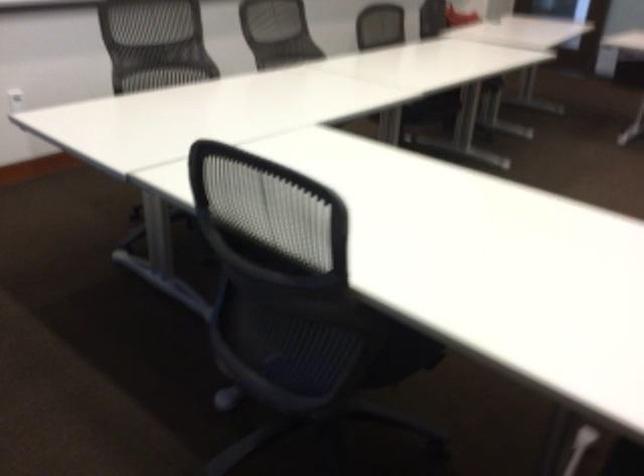
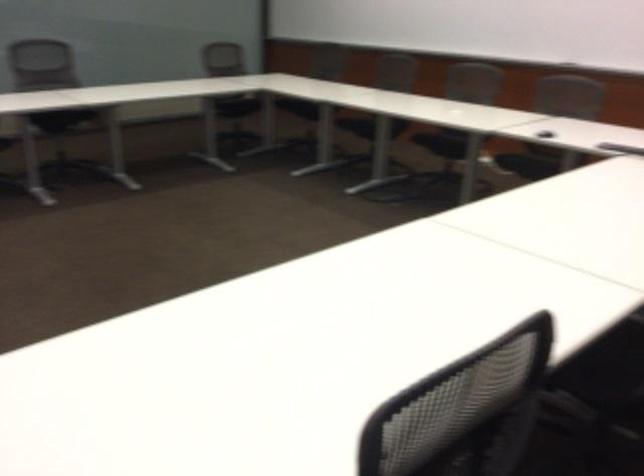
The images are taken continuously from a first-person perspective. In which direction is your viewpoint rotating?

The camera rotated toward right-down.